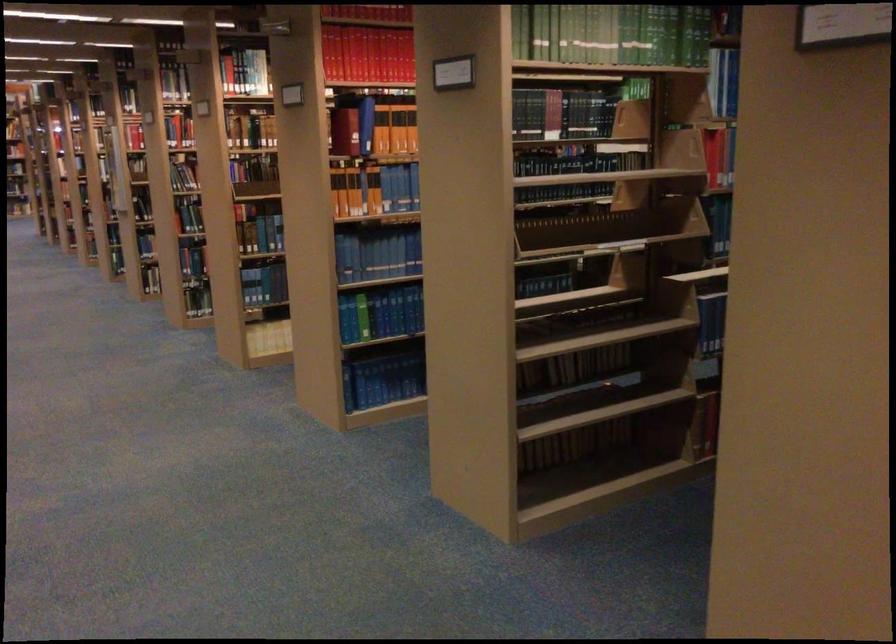
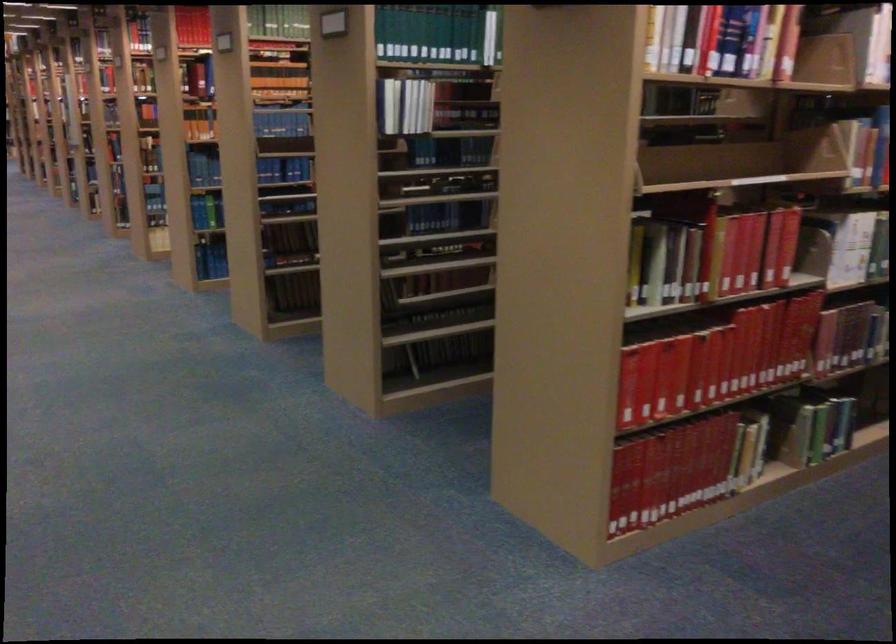
What movement of the cameraman would produce the second image?

The cameraman moved toward right, backward.